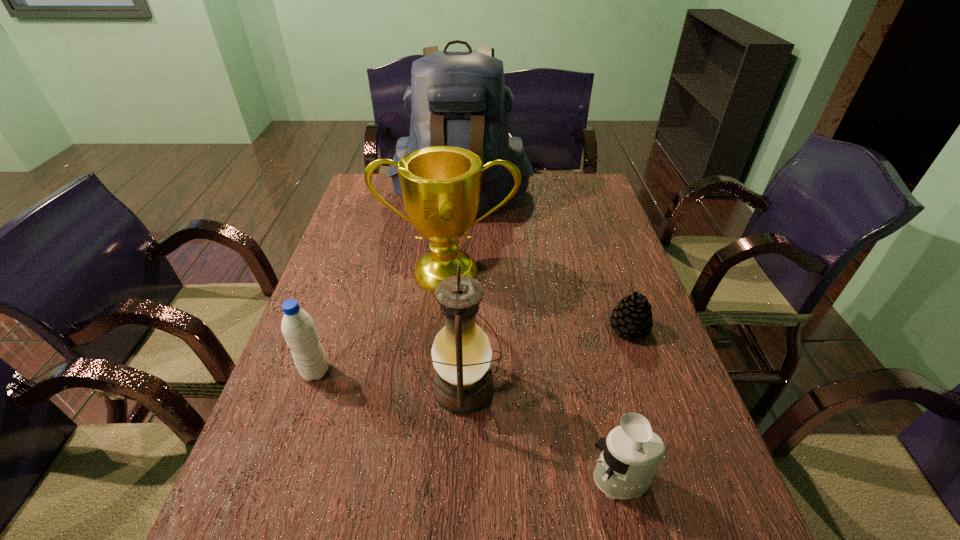
You are a GUI agent. You are given a task and a screenshot of the screen. Output one action in this format:
    pyautogui.click(x=<x>, y=<y>)
    Task: Click on the vacant region located 0.330m on the shiny surface of the award
    Image resolution: width=960 pixels, height=540 pixels.
    Given the screenshot: What is the action you would take?
    pyautogui.click(x=438, y=401)

Locate an element on the screen. This screenshot has height=540, width=960. vacant space located 0.210m on the right of the oil lamp is located at coordinates (596, 388).

The height and width of the screenshot is (540, 960). I want to click on vacant space positioned on the front of the water bottle, so click(261, 529).

Locate an element on the screen. This screenshot has width=960, height=540. free location located on the back of the second shortest object is located at coordinates (607, 418).

Where is `blank space located at the narrow end of the shortest object`? The width and height of the screenshot is (960, 540). blank space located at the narrow end of the shortest object is located at coordinates (562, 328).

You are a GUI agent. You are given a task and a screenshot of the screen. Output one action in this format:
    pyautogui.click(x=<x>, y=<y>)
    Task: Click on the free space located at the narrow end of the shortest object
    
    Given the screenshot: What is the action you would take?
    pyautogui.click(x=459, y=328)

Identify the location of vacant space situated 0.090m at the narrow end of the shortest object. The width and height of the screenshot is (960, 540). [573, 328].

Find the location of `object situated at the far edge`. object situated at the far edge is located at coordinates (459, 99).

You are a GUI agent. You are given a task and a screenshot of the screen. Output one action in this format:
    pyautogui.click(x=<x>, y=<y>)
    Task: Click on the backpack located in the left edge section of the desktop
    
    Given the screenshot: What is the action you would take?
    pyautogui.click(x=459, y=99)

I want to click on water bottle that is at the left edge, so click(x=298, y=328).